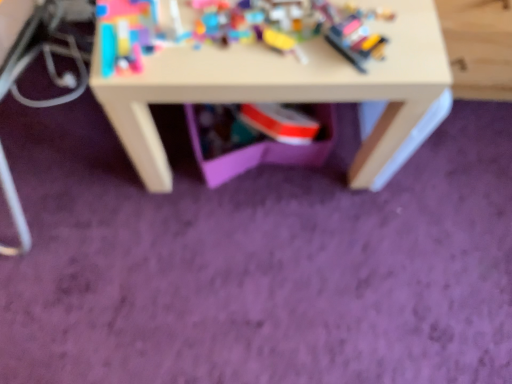
Question: Relative to matte white table at center, is plastic building blocks at upper center in front or behind?

Choices:
 (A) front
 (B) behind

Answer: (A)

Question: Is plastic building blocks at upper center taller or shorter than matte white table at center?

Choices:
 (A) tall
 (B) short

Answer: (B)

Question: Considering the positions of point (262, 13) and point (386, 82), is point (262, 13) closer or farther from the camera than point (386, 82)?

Choices:
 (A) closer
 (B) farther

Answer: (B)

Question: From their relative heights in the image, would you say matte white table at center is taller or shorter than plastic building blocks at upper center?

Choices:
 (A) short
 (B) tall

Answer: (B)

Question: Would you say matte white table at center is to the left or to the right of plastic building blocks at upper center in the picture?

Choices:
 (A) left
 (B) right

Answer: (B)

Question: From a real-world perspective, is matte white table at center above or below plastic building blocks at upper center?

Choices:
 (A) above
 (B) below

Answer: (B)

Question: From the image's perspective, is matte white table at center above or below plastic building blocks at upper center?

Choices:
 (A) above
 (B) below

Answer: (A)